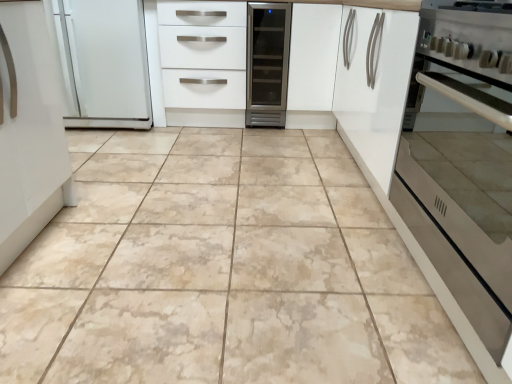
Question: From a real-world perspective, is white glossy drawers at center positioned over beige marble tile at center based on gravity?

Choices:
 (A) no
 (B) yes

Answer: (B)

Question: Is white glossy drawers at center surrounding beige marble tile at center?

Choices:
 (A) no
 (B) yes

Answer: (A)

Question: Considering the relative sizes of white glossy drawers at center and beige marble tile at center in the image provided, is white glossy drawers at center smaller than beige marble tile at center?

Choices:
 (A) yes
 (B) no

Answer: (A)

Question: Is white glossy drawers at center not close to beige marble tile at center?

Choices:
 (A) no
 (B) yes

Answer: (B)

Question: Does white glossy drawers at center come in front of beige marble tile at center?

Choices:
 (A) yes
 (B) no

Answer: (B)

Question: Is satin silver oven at right to the left or to the right of white glossy drawers at center in the image?

Choices:
 (A) left
 (B) right

Answer: (B)

Question: Looking at their shapes, would you say satin silver oven at right is wider or thinner than white glossy drawers at center?

Choices:
 (A) thin
 (B) wide

Answer: (A)

Question: In terms of height, does satin silver oven at right look taller or shorter compared to white glossy drawers at center?

Choices:
 (A) tall
 (B) short

Answer: (B)

Question: Does point (492, 380) appear closer or farther from the camera than point (241, 97)?

Choices:
 (A) farther
 (B) closer

Answer: (B)

Question: Looking at the image, does satin silver oven at right seem bigger or smaller compared to white matte cabinet at center?

Choices:
 (A) small
 (B) big

Answer: (B)

Question: From a real-world perspective, relative to white matte cabinet at center, is satin silver oven at right vertically above or below?

Choices:
 (A) above
 (B) below

Answer: (B)

Question: Would you say satin silver oven at right is to the left or to the right of white matte cabinet at center in the picture?

Choices:
 (A) right
 (B) left

Answer: (A)

Question: From the image's perspective, is satin silver oven at right above or below white matte cabinet at center?

Choices:
 (A) below
 (B) above

Answer: (A)

Question: Which is correct: beige marble tile at center is inside white glossy drawers at center, or outside of it?

Choices:
 (A) inside
 (B) outside

Answer: (B)

Question: Visually, is beige marble tile at center positioned to the left or to the right of white glossy drawers at center?

Choices:
 (A) right
 (B) left

Answer: (A)